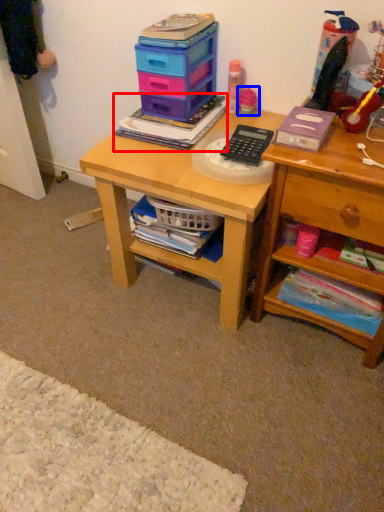
Question: Which point is closer to the camera, book (highlighted by a red box) or toy (highlighted by a blue box)?

Choices:
 (A) book
 (B) toy

Answer: (A)